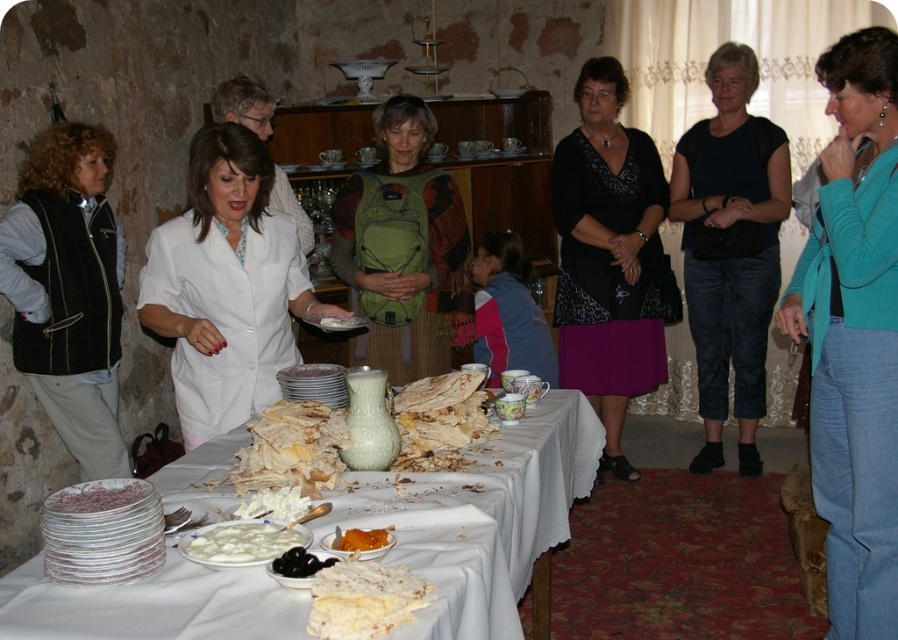
Question: Is white ceramic table at center smaller than crumbly golden pancake at center?

Choices:
 (A) yes
 (B) no

Answer: (B)

Question: Which object is positioned farthest from the white fabric at center?

Choices:
 (A) crumbly white cake at center
 (B) white glossy pitcher at center
 (C) black vest at left
 (D) golden syrup jar at center

Answer: (A)

Question: Which point appears closest to the camera in this image?

Choices:
 (A) (751, 214)
 (B) (119, 497)

Answer: (B)

Question: Considering the real-world distances, which object is farthest from the teal sweater at center?

Choices:
 (A) black textured dress at center
 (B) pink fabric at center

Answer: (B)

Question: Does teal sweater at center have a greater width compared to black cotton shirt at center?

Choices:
 (A) yes
 (B) no

Answer: (B)

Question: Is black textured dress at center thinner than crumbly golden pancake at center?

Choices:
 (A) no
 (B) yes

Answer: (A)